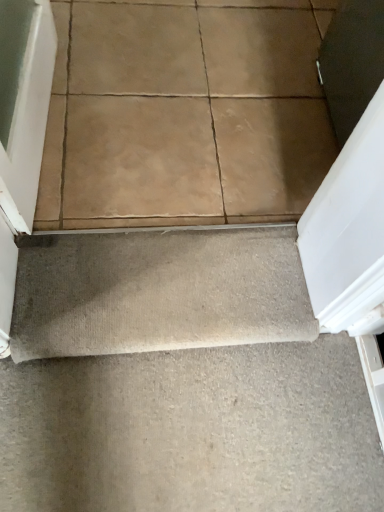
Question: Should I look upward or downward to see brown matte tile at center?

Choices:
 (A) up
 (B) down

Answer: (A)